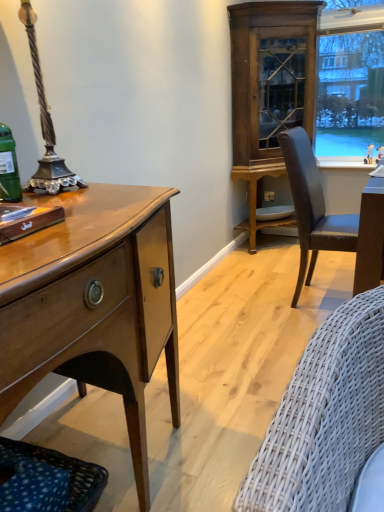
Question: From the image's perspective, does matte plastic power outlet at lower center appear lower than shiny brown desk at left?

Choices:
 (A) yes
 (B) no

Answer: (B)

Question: From the image's perspective, is matte plastic power outlet at lower center on shiny brown desk at left?

Choices:
 (A) yes
 (B) no

Answer: (A)

Question: Is matte plastic power outlet at lower center to the right of shiny brown desk at left from the viewer's perspective?

Choices:
 (A) yes
 (B) no

Answer: (A)

Question: Can you confirm if matte plastic power outlet at lower center is taller than shiny brown desk at left?

Choices:
 (A) yes
 (B) no

Answer: (B)

Question: Is matte plastic power outlet at lower center positioned with its back to shiny brown desk at left?

Choices:
 (A) yes
 (B) no

Answer: (B)

Question: From a real-world perspective, is matte plastic power outlet at lower center on shiny brown desk at left?

Choices:
 (A) no
 (B) yes

Answer: (A)

Question: Is the surface of matte plastic power outlet at lower center in direct contact with white glossy plate at lower center?

Choices:
 (A) yes
 (B) no

Answer: (B)

Question: Is matte plastic power outlet at lower center thinner than white glossy plate at lower center?

Choices:
 (A) yes
 (B) no

Answer: (A)

Question: Does matte plastic power outlet at lower center have a greater width compared to white glossy plate at lower center?

Choices:
 (A) no
 (B) yes

Answer: (A)

Question: From a real-world perspective, does matte plastic power outlet at lower center stand above white glossy plate at lower center?

Choices:
 (A) yes
 (B) no

Answer: (A)

Question: From the image's perspective, is matte plastic power outlet at lower center over white glossy plate at lower center?

Choices:
 (A) yes
 (B) no

Answer: (A)

Question: Is matte plastic power outlet at lower center facing away from white glossy plate at lower center?

Choices:
 (A) yes
 (B) no

Answer: (B)

Question: Considering the relative sizes of wooden cabinet at upper right and dark blue woven fabric couch at lower left in the image provided, is wooden cabinet at upper right shorter than dark blue woven fabric couch at lower left?

Choices:
 (A) yes
 (B) no

Answer: (B)